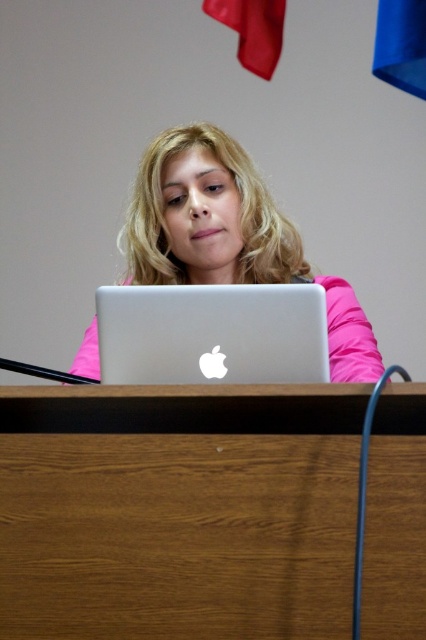
Between matte silver laptop at center and silver metallic laptop at center, which one has more height?

With more height is matte silver laptop at center.

Who is positioned more to the right, matte silver laptop at center or silver metallic laptop at center?

silver metallic laptop at center

Which is behind, point (299, 250) or point (155, 376)?

Point (299, 250)

Find the location of a particular element. The image size is (426, 640). matte silver laptop at center is located at coordinates (230, 236).

Find the location of a particular element. brown wood table at center is located at coordinates (178, 509).

Find the location of a particular element. brown wood table at center is located at coordinates pos(178,509).

Between brown wood table at center and silver metallic laptop at center, which one is positioned lower?

brown wood table at center

Is brown wood table at center positioned behind silver metallic laptop at center?

No, it is in front of silver metallic laptop at center.

In the scene shown: Measure the distance between point (9, 412) and camera.

A distance of 3.31 feet exists between point (9, 412) and camera.

Where is `brown wood table at center`? This screenshot has width=426, height=640. brown wood table at center is located at coordinates (178, 509).